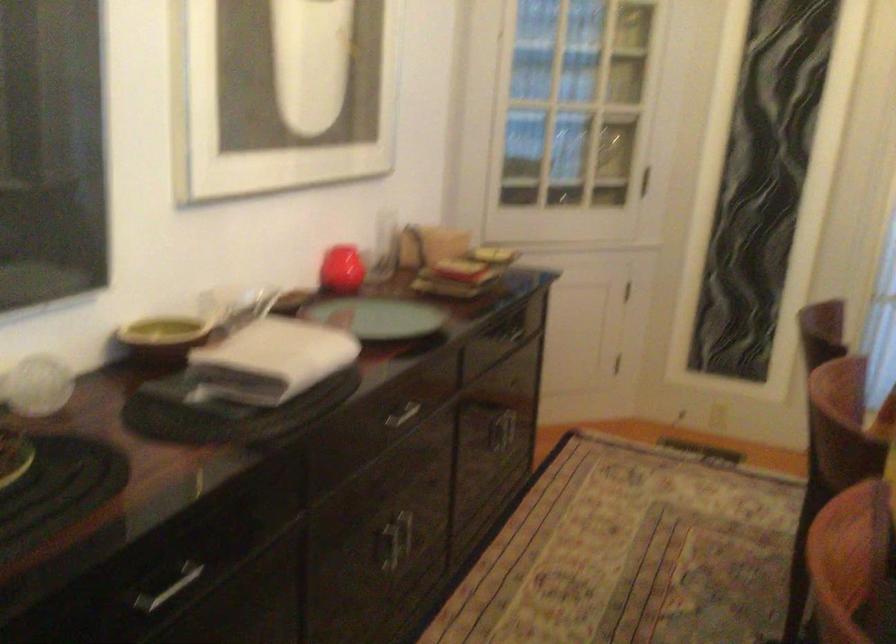
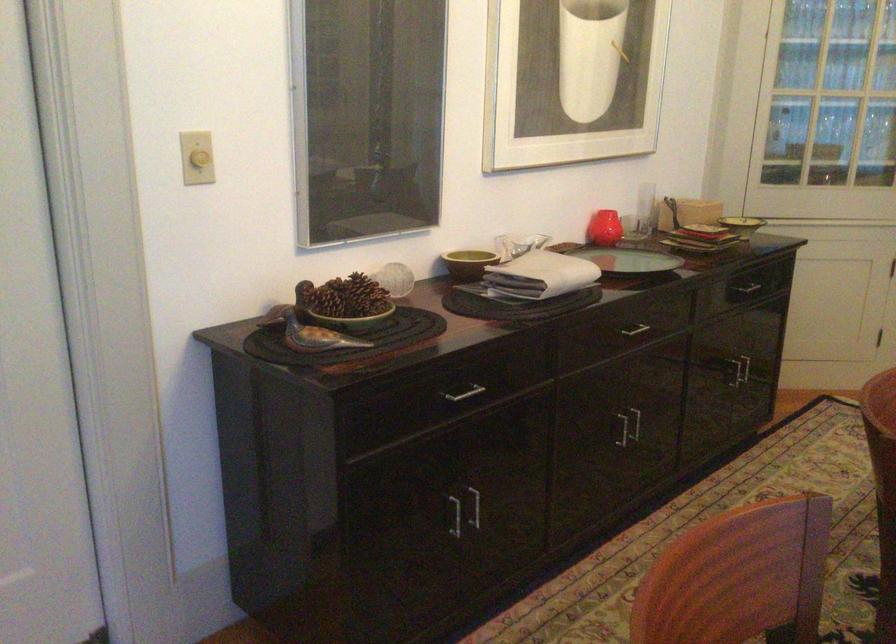
Locate, in the second image, the point that corresponds to the point at 400,415 in the first image.

(634, 328)